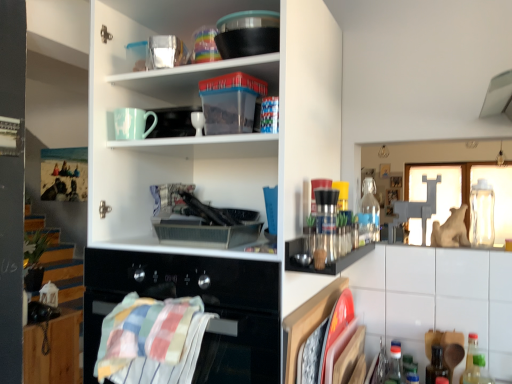
Question: Is white glossy cabinet at lower right, the second cabinetry ordered from the bottom, inside or outside of blue plastic bottle at lower right, arranged as the second bottle when viewed from the front?

Choices:
 (A) outside
 (B) inside

Answer: (A)

Question: Is white glossy cabinet at lower right, the 1th cabinetry in the front-to-back sequence, bigger or smaller than blue plastic bottle at lower right, arranged as the second bottle when viewed from the front?

Choices:
 (A) big
 (B) small

Answer: (A)

Question: Which of these objects is positioned farthest from the clear glass bottle at upper right, the 5th bottle from the front?

Choices:
 (A) clear glass bottle at upper right, arranged as the second bottle when viewed from the back
 (B) transparent plastic bottle at lower right, which is counted as the third bottle, starting from the front
 (C) green glass bottle at right, arranged as the 2th bottle when viewed from the right
 (D) wooden cabinet at lower left, the 1th cabinetry in the bottom-to-top sequence
 (E) blue plastic bottle at lower right, the third bottle from the right

Answer: (D)

Question: Which is farther from the white matte cupboard at upper left?

Choices:
 (A) striped cotton towel at lower left
 (B) clear glass bottle at upper right, the first bottle in the left-to-right sequence
 (C) clear glass bottle at upper right, the 1th bottle when ordered from right to left
 (D) transparent plastic bottle at lower right, which is the 2th bottle from left to right
 (E) blue plastic bottle at lower right, the third bottle when ordered from left to right

Answer: (C)